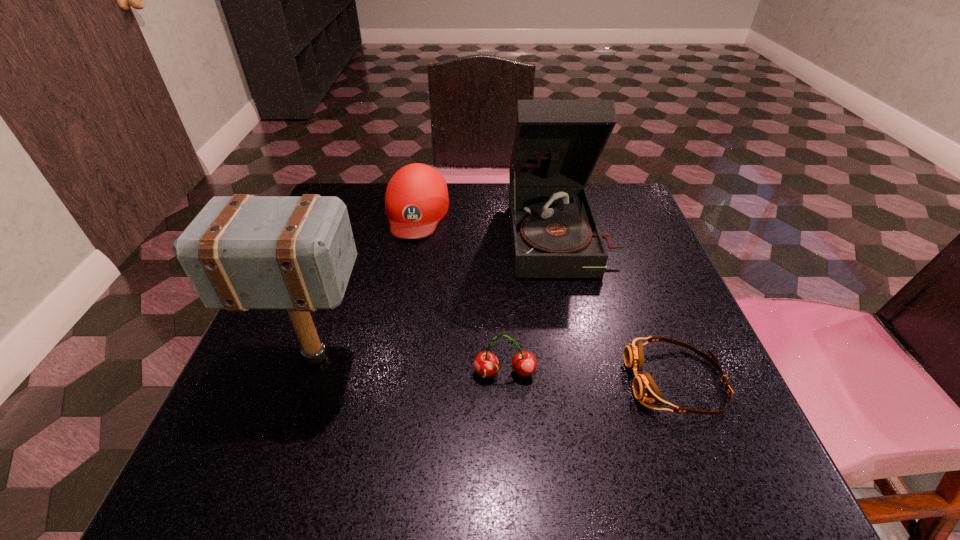
Where is `free spot located 0.230m with the lenses facing forward on the shortest object`? free spot located 0.230m with the lenses facing forward on the shortest object is located at coordinates [492, 381].

The image size is (960, 540). In order to click on free space located with the lenses facing forward on the shortest object in this screenshot , I will do `click(516, 381)`.

Where is `phonograph_record that is at the far edge`? The width and height of the screenshot is (960, 540). phonograph_record that is at the far edge is located at coordinates (556, 144).

Find the location of a particular element. baseball cap located at the far edge is located at coordinates (416, 199).

This screenshot has height=540, width=960. I want to click on object that is at the left edge, so click(243, 252).

Where is `phonograph_record present at the right edge`? The height and width of the screenshot is (540, 960). phonograph_record present at the right edge is located at coordinates (556, 144).

Image resolution: width=960 pixels, height=540 pixels. Find the location of `goggles located at the right edge`. goggles located at the right edge is located at coordinates (644, 387).

Locate an element on the screen. The height and width of the screenshot is (540, 960). object that is at the far right corner is located at coordinates (556, 144).

You are a GUI agent. You are given a task and a screenshot of the screen. Output one action in this format:
    pyautogui.click(x=<x>, y=<y>)
    Task: Click on the vacant space at the far edge of the desktop
    
    Given the screenshot: What is the action you would take?
    pyautogui.click(x=477, y=202)

Where is `vacant area at the near edge`? This screenshot has height=540, width=960. vacant area at the near edge is located at coordinates (306, 495).